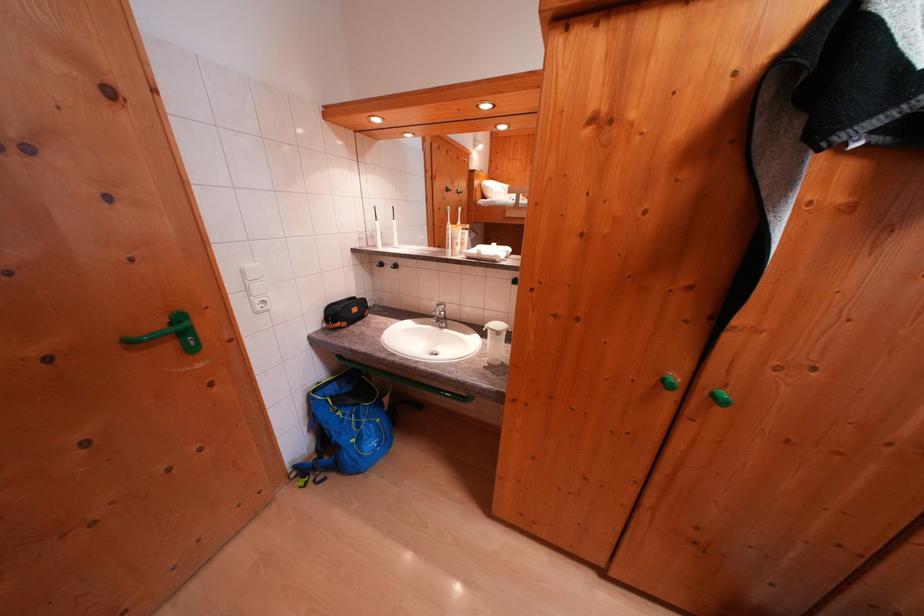
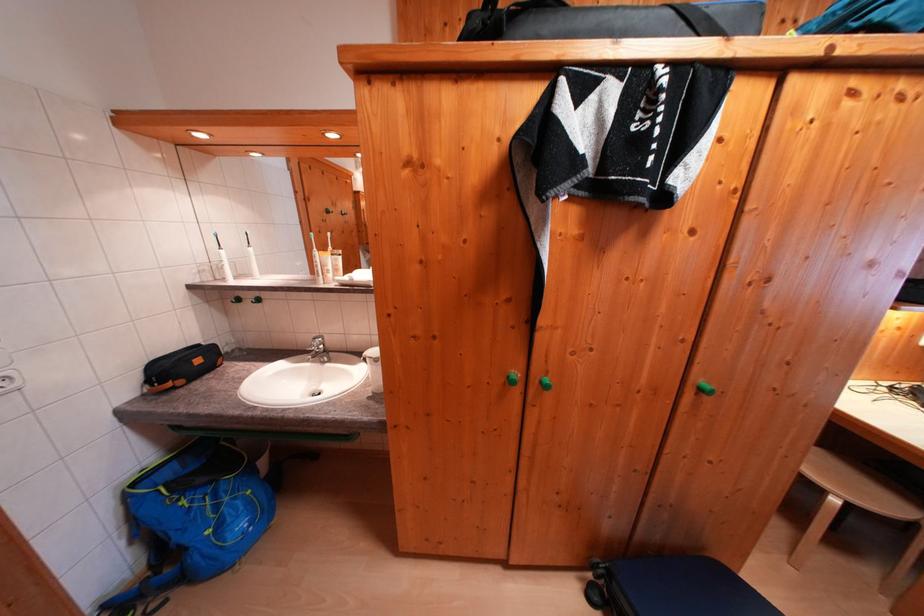
Find the pixel in the second image that matches point (463, 225) in the first image.

(331, 253)